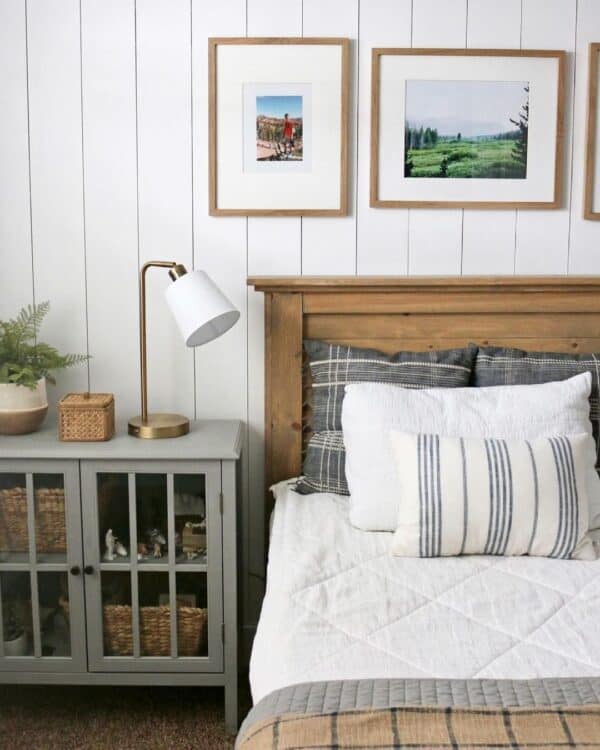
You are a GUI agent. You are given a task and a screenshot of the screen. Output one action in this format:
    pyautogui.click(x=<x>, y=<y>)
    Task: Click on the picture mat
    
    Given the screenshot: What is the action you would take?
    pyautogui.click(x=317, y=192), pyautogui.click(x=387, y=184)